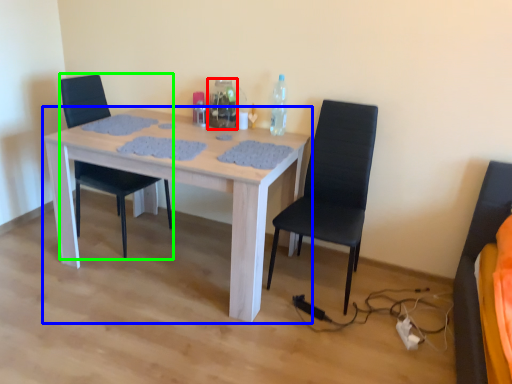
Question: Which object is the farthest from bottle (highlighted by a red box)? Choose among these: kitchen & dining room table (highlighted by a blue box) or chair (highlighted by a green box).

Choices:
 (A) kitchen & dining room table
 (B) chair

Answer: (B)